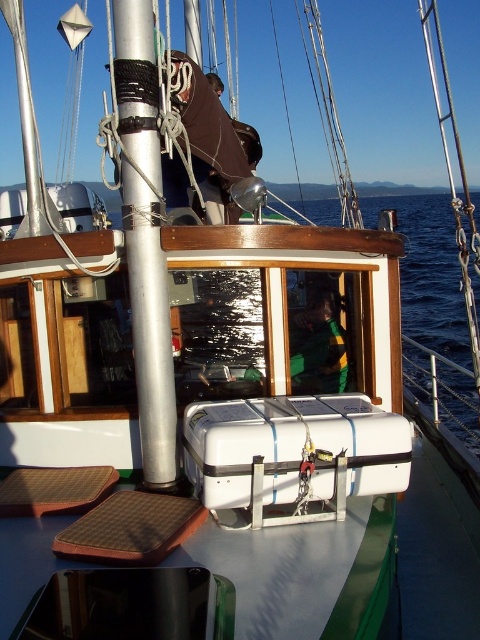
You are a sailor on the deck of the sailboat. You need to retrieve a bottle of water from the cooler. The cooler is secured with a blue strap. Which object is higher in elevation between the blue water at center and the brown leather seat at upper center?

The blue water at center is located above the brown leather seat at upper center, so the blue water at center has a higher elevation.